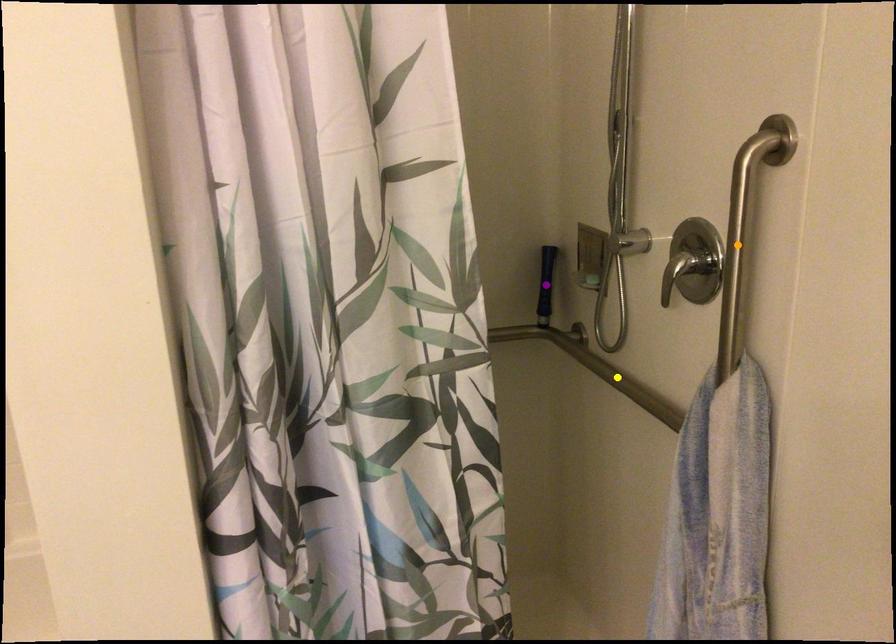
Order these from nearest to farthest:
- purple point
- yellow point
- orange point

orange point, yellow point, purple point